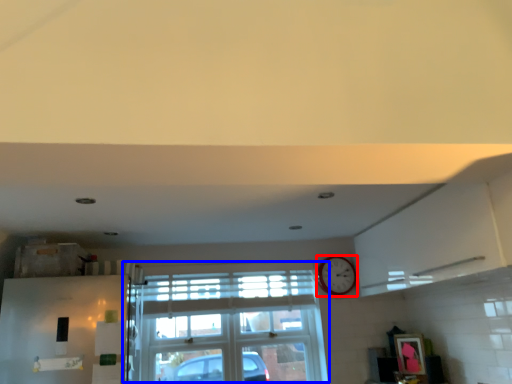
Question: Which object appears closest to the camera in this image, clock (highlighted by a red box) or window (highlighted by a blue box)?

Choices:
 (A) clock
 (B) window

Answer: (B)